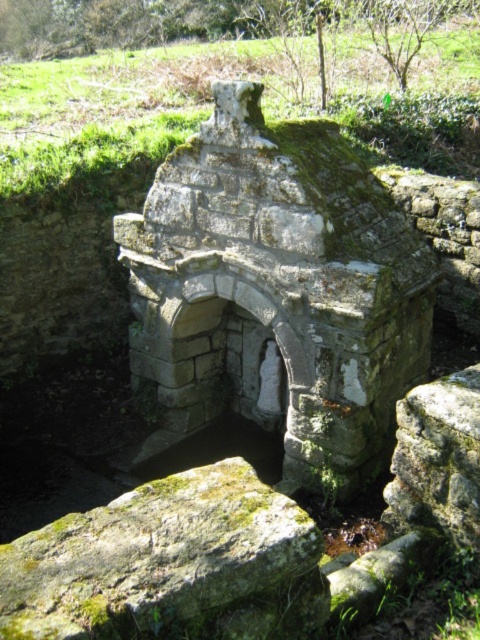
Question: Which of these objects is positioned closest to the green mossy rock at center?

Choices:
 (A) green mossy stone at center
 (B) green mossy rock at lower left

Answer: (B)

Question: Can you confirm if green mossy stone at center is positioned below green mossy rock at center?

Choices:
 (A) no
 (B) yes

Answer: (A)

Question: Can you confirm if green mossy stone at center is wider than green mossy rock at lower left?

Choices:
 (A) yes
 (B) no

Answer: (A)

Question: Among these points, which one is farthest from the camera?

Choices:
 (A) (252, 292)
 (B) (396, 444)
 (C) (23, 536)

Answer: (B)

Question: Does green mossy stone at center appear on the right side of green mossy rock at lower left?

Choices:
 (A) no
 (B) yes

Answer: (B)

Question: Which of these objects is positioned farthest from the green mossy rock at center?

Choices:
 (A) green mossy stone at center
 (B) green mossy rock at lower left

Answer: (A)